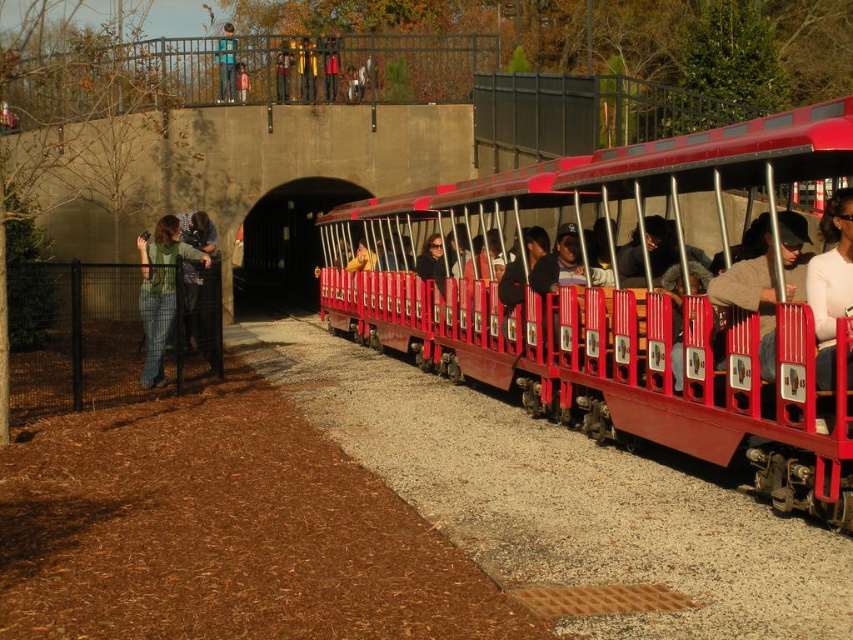
You are a parent holding a child wearing a green sweater at left. The metallic red train at right is approaching the tunnel. Can you safely walk towards the train to hand over the child before it enters the tunnel, if your walking speed is 1.2 meters per second?

The distance between the metallic red train at right and the green sweater at left is 6.13 meters. At a walking speed of 1.2 meters per second, it would take approximately 5.11 seconds to cover the distance. However, without knowing the train speed, it is impossible to determine if you can reach the train before it enters the tunnel.

You are standing at the point labeled with coordinates point (631, 296). What object are you facing?

The point (631, 296) corresponds to the metallic red train at right, so you are facing the metallic red train at right.